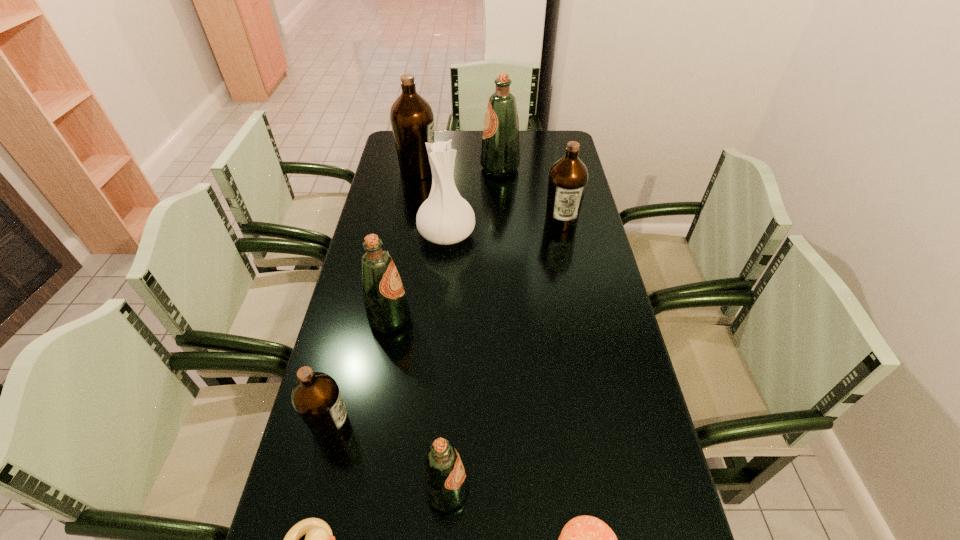
Where is `the smallest brown olive oil`? the smallest brown olive oil is located at coordinates (316, 397).

This screenshot has height=540, width=960. Identify the location of the sixth farthest object. (316, 397).

Find the location of a particular element. The image size is (960, 540). vacant space situated 0.080m on the front-facing side of the farthest green olive oil is located at coordinates (461, 169).

Identify the location of vacant space located 0.170m on the front-facing side of the farthest green olive oil. The width and height of the screenshot is (960, 540). (439, 169).

This screenshot has height=540, width=960. Find the location of `free space located 0.080m on the front-facing side of the farthest green olive oil`. free space located 0.080m on the front-facing side of the farthest green olive oil is located at coordinates (461, 169).

Locate an element on the screen. This screenshot has height=540, width=960. vacant space located on the label of the farthest brown olive oil is located at coordinates (460, 171).

Locate an element on the screen. This screenshot has width=960, height=540. vacant space located 0.070m on the front of the vase is located at coordinates (444, 269).

Where is `free point located on the front-facing side of the fifth nearest object`? free point located on the front-facing side of the fifth nearest object is located at coordinates (553, 319).

Where is `free point located on the label of the second biggest brown olive oil`? This screenshot has height=540, width=960. free point located on the label of the second biggest brown olive oil is located at coordinates (579, 307).

This screenshot has height=540, width=960. In order to click on free region located 0.360m on the front-facing side of the third nearest object in this screenshot , I will do `click(640, 491)`.